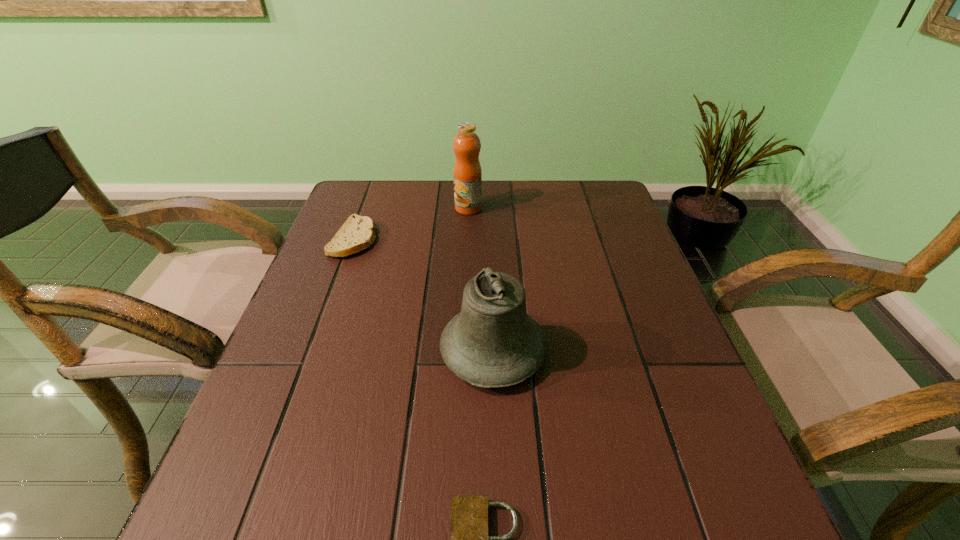
Identify the location of vacant space that is in between the second nearest object and the leftmost object. Image resolution: width=960 pixels, height=540 pixels. (423, 295).

At what (x,y) coordinates should I click in order to perform the action: click on free space between the farthest object and the leftmost object. Please return your answer as a coordinate pair (x, y). This screenshot has height=540, width=960. Looking at the image, I should click on (411, 224).

This screenshot has width=960, height=540. I want to click on object that stands as the third closest to the second tallest object, so click(467, 173).

Locate which object is the second closest to the farthest object. Please provide its 2D coordinates. Your answer should be formatted as a tuple, i.e. [(x, y)], where the tuple contains the x and y coordinates of a point satisfying the conditions above.

[(493, 342)]